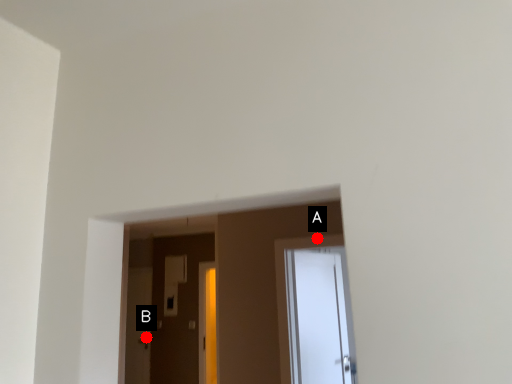
Question: Two points are circled on the image, labeled by A and B beside each circle. Which point appears farthest from the camera in this image?

Choices:
 (A) A is further
 (B) B is further

Answer: (B)